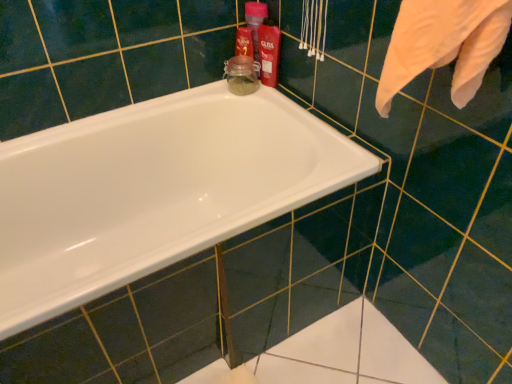
Question: Does white glossy bathtub at center appear on the left side of shiny red plastic bottle at upper right, which ranks as the first cleaning product in front-to-back order?

Choices:
 (A) no
 (B) yes

Answer: (B)

Question: Does white glossy bathtub at center have a greater width compared to shiny red plastic bottle at upper right, the second cleaning product positioned from the back?

Choices:
 (A) no
 (B) yes

Answer: (B)

Question: From a real-world perspective, is white glossy bathtub at center below shiny red plastic bottle at upper right, the second cleaning product positioned from the back?

Choices:
 (A) yes
 (B) no

Answer: (A)

Question: From the image's perspective, is white glossy bathtub at center over shiny red plastic bottle at upper right, the second cleaning product positioned from the back?

Choices:
 (A) no
 (B) yes

Answer: (A)

Question: Can you confirm if white glossy bathtub at center is shorter than shiny red plastic bottle at upper right, which ranks as the first cleaning product in front-to-back order?

Choices:
 (A) yes
 (B) no

Answer: (B)

Question: Is point (259, 6) positioned closer to the camera than point (260, 44)?

Choices:
 (A) farther
 (B) closer

Answer: (B)

Question: Considering their positions, is matte plastic bottle at upper right, the first cleaning product in the back-to-front sequence, located in front of or behind shiny red plastic bottle at upper right, which ranks as the first cleaning product in front-to-back order?

Choices:
 (A) behind
 (B) front

Answer: (A)

Question: From the image's perspective, is matte plastic bottle at upper right, the first cleaning product in the back-to-front sequence, above or below shiny red plastic bottle at upper right, the second cleaning product positioned from the back?

Choices:
 (A) below
 (B) above

Answer: (B)

Question: Based on their sizes in the image, would you say matte plastic bottle at upper right, the 2th cleaning product when ordered from front to back, is bigger or smaller than shiny red plastic bottle at upper right, the second cleaning product positioned from the back?

Choices:
 (A) big
 (B) small

Answer: (A)

Question: Considering the positions of point pos(260,76) and point pos(206,230), is point pos(260,76) closer or farther from the camera than point pos(206,230)?

Choices:
 (A) closer
 (B) farther

Answer: (B)

Question: In the image, is matte plastic bottle at upper right, the 2th cleaning product when ordered from front to back, positioned in front of or behind white glossy bathtub at center?

Choices:
 (A) front
 (B) behind

Answer: (B)

Question: In the image, is matte plastic bottle at upper right, the first cleaning product in the back-to-front sequence, on the left side or the right side of white glossy bathtub at center?

Choices:
 (A) left
 (B) right

Answer: (B)

Question: In terms of width, does matte plastic bottle at upper right, the first cleaning product in the back-to-front sequence, look wider or thinner when compared to white glossy bathtub at center?

Choices:
 (A) thin
 (B) wide

Answer: (A)

Question: Choose the correct answer: Is shiny red plastic bottle at upper right, which ranks as the first cleaning product in front-to-back order, inside matte plastic bottle at upper right, the first cleaning product in the back-to-front sequence, or outside it?

Choices:
 (A) inside
 (B) outside

Answer: (B)

Question: From a real-world perspective, relative to matte plastic bottle at upper right, the first cleaning product in the back-to-front sequence, is shiny red plastic bottle at upper right, the second cleaning product positioned from the back, vertically above or below?

Choices:
 (A) below
 (B) above

Answer: (B)